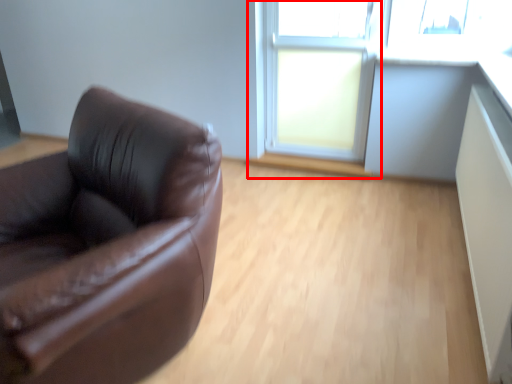
Question: Where is window frame (annotated by the red box) located in relation to window in the image?

Choices:
 (A) right
 (B) left

Answer: (A)